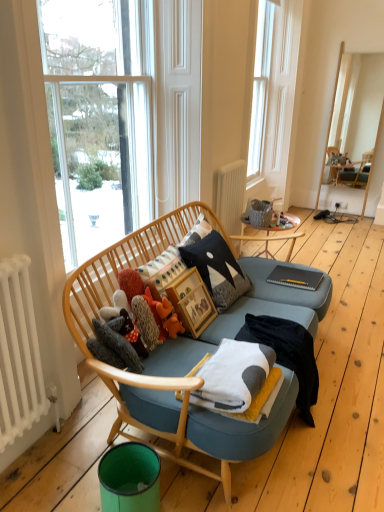
What do you see at coordinates (242, 426) in the screenshot? I see `soft yellow fabric footrest at center` at bounding box center [242, 426].

Locate an element on the screen. The width and height of the screenshot is (384, 512). fluffy orange plush at center, which appears as the 1th toy when viewed from the right is located at coordinates (169, 318).

This screenshot has width=384, height=512. What do you see at coordinates (268, 234) in the screenshot?
I see `wooden table at center` at bounding box center [268, 234].

I want to click on slate gray notebook at center, so click(295, 277).

Is white painted radiator at center, acting as the 2th radiator starting from the left, touching white radiator at lower left, marked as the 2th radiator in a top-to-bottom arrangement?

There is a gap between white painted radiator at center, acting as the 2th radiator starting from the left, and white radiator at lower left, marked as the 2th radiator in a top-to-bottom arrangement.

Is white painted radiator at center, placed as the 2th radiator when sorted from bottom to top, inside or outside of white radiator at lower left, the 1th radiator viewed from the front?

The correct answer is: outside.

From the image's perspective, between white painted radiator at center, the 2th radiator viewed from the front, and white radiator at lower left, positioned as the 2th radiator in right-to-left order, who is located below?

white radiator at lower left, positioned as the 2th radiator in right-to-left order, is shown below in the image.

Considering the sizes of objects white painted radiator at center, acting as the 2th radiator starting from the left, and white radiator at lower left, which is the first radiator in bottom-to-top order, in the image provided, who is wider, white painted radiator at center, acting as the 2th radiator starting from the left, or white radiator at lower left, which is the first radiator in bottom-to-top order,?

Wider between the two is white radiator at lower left, which is the first radiator in bottom-to-top order.

Does black cotton throw pillow at center have a lesser height compared to white radiator at lower left, arranged as the first radiator when viewed from the left?

Yes, black cotton throw pillow at center is shorter than white radiator at lower left, arranged as the first radiator when viewed from the left.

From a real-world perspective, who is located higher, black cotton throw pillow at center or white radiator at lower left, which appears as the 2th radiator when viewed from the back?

black cotton throw pillow at center.

In the image, is black cotton throw pillow at center on the left side or the right side of white radiator at lower left, arranged as the first radiator when viewed from the left?

black cotton throw pillow at center is positioned on white radiator at lower left, arranged as the first radiator when viewed from the left,'s right side.

Between white painted radiator at center, the 2th radiator viewed from the front, and fluffy orange plush at center, the second toy from the left, which one has larger size?

With larger size is white painted radiator at center, the 2th radiator viewed from the front.

From the image's perspective, is white painted radiator at center, placed as the 2th radiator when sorted from bottom to top, above or below fluffy orange plush at center, the second toy from the left?

Based on their image positions, white painted radiator at center, placed as the 2th radiator when sorted from bottom to top, is located above fluffy orange plush at center, the second toy from the left.

Between white painted radiator at center, acting as the 2th radiator starting from the left, and fluffy orange plush at center, which appears as the 1th toy when viewed from the right, which one appears on the right side from the viewer's perspective?

→ Positioned to the right is white painted radiator at center, acting as the 2th radiator starting from the left.

Is white painted radiator at center, the first radiator from the top, thinner than fluffy orange plush at center, the second toy from the left?

Correct, the width of white painted radiator at center, the first radiator from the top, is less than that of fluffy orange plush at center, the second toy from the left.

Can you tell me how much slate gray notebook at center and green matte trash can at lower left differ in facing direction?

2.25 degrees separate the facing orientations of slate gray notebook at center and green matte trash can at lower left.

From a real-world perspective, is slate gray notebook at center positioned above or below green matte trash can at lower left?

In terms of real-world spatial position, slate gray notebook at center is above green matte trash can at lower left.

Which point is more forward, (290, 268) or (140, 454)?

Point (140, 454)

From a real-world perspective, which is physically above, white radiator at lower left, arranged as the first radiator when viewed from the left, or white soft blanket at center, which is the second blanket from back to front?

white radiator at lower left, arranged as the first radiator when viewed from the left.

Consider the image. Which is more to the left, white radiator at lower left, arranged as the first radiator when viewed from the left, or white soft blanket at center, arranged as the 1th blanket when viewed from the front?

From the viewer's perspective, white radiator at lower left, arranged as the first radiator when viewed from the left, appears more on the left side.

Is white radiator at lower left, marked as the 2th radiator in a top-to-bottom arrangement, not within white soft blanket at center, which is the second blanket from back to front?

Yes, white radiator at lower left, marked as the 2th radiator in a top-to-bottom arrangement, is outside of white soft blanket at center, which is the second blanket from back to front.

In terms of size, does white radiator at lower left, marked as the 2th radiator in a top-to-bottom arrangement, appear bigger or smaller than white soft blanket at center, which is the second blanket from back to front?

Clearly, white radiator at lower left, marked as the 2th radiator in a top-to-bottom arrangement, is larger in size than white soft blanket at center, which is the second blanket from back to front.

Considering the sizes of transparent glass window at upper center and white radiator at lower left, positioned as the 2th radiator in right-to-left order, in the image, is transparent glass window at upper center taller or shorter than white radiator at lower left, positioned as the 2th radiator in right-to-left order,?

In the image, transparent glass window at upper center appears to be taller than white radiator at lower left, positioned as the 2th radiator in right-to-left order.

You are a GUI agent. You are given a task and a screenshot of the screen. Output one action in this format:
    pyautogui.click(x=<x>, y=<y>)
    Task: Click on the window above the white radiator at lower left, arranged as the first radiator when viewed from the left (from a real-world perspective)
    The width and height of the screenshot is (384, 512).
    Given the screenshot: What is the action you would take?
    pyautogui.click(x=273, y=96)

In the scene shown: Is transparent glass window at upper center closer to the viewer compared to white radiator at lower left, the 1th radiator viewed from the front?

No, it is not.

Does point (263, 136) appear closer or farther from the camera than point (23, 378)?

Point (263, 136) is positioned farther from the camera compared to point (23, 378).

Which of these two, fluffy orange plush at center, the second toy from the left, or wooden table at center, is wider?

With larger width is wooden table at center.

Are fluffy orange plush at center, the second toy from the left, and wooden table at center located far from each other?

Absolutely, fluffy orange plush at center, the second toy from the left, is distant from wooden table at center.

From the image's perspective, is fluffy orange plush at center, the second toy from the left, below wooden table at center?

Yes, from the image's perspective, fluffy orange plush at center, the second toy from the left, is beneath wooden table at center.

Where is `radiator in front of the white painted radiator at center, acting as the 2th radiator starting from the left`? This screenshot has height=512, width=384. radiator in front of the white painted radiator at center, acting as the 2th radiator starting from the left is located at coordinates (20, 355).

What are the coordinates of `radiator lying below the black cotton throw pillow at center (from the image's perspective)` in the screenshot? It's located at (20, 355).

From the picture: Considering their positions, is wooden table at center positioned closer to white radiator at lower left, positioned as the 2th radiator in right-to-left order, than black cotton throw pillow at center?

black cotton throw pillow at center lies closer to white radiator at lower left, positioned as the 2th radiator in right-to-left order, than the other object.

Estimate the real-world distances between objects in this image. Which object is closer to fuzzy fabric stuffed animal at center, which ranks as the first toy in left-to-right order, green matte trash can at lower left or white soft blanket at center, which is the second blanket from back to front?

white soft blanket at center, which is the second blanket from back to front, is closer to fuzzy fabric stuffed animal at center, which ranks as the first toy in left-to-right order.

From the image, which object appears to be nearer to slate gray notebook at center, fluffy orange plush at center, the second toy from the left, or wooden table at center?

wooden table at center.

Based on their spatial positions, is fluffy orange plush at center, which appears as the 1th toy when viewed from the right, or white soft blanket at center, which is the second blanket from back to front, further from slate gray notebook at center?

The object further to slate gray notebook at center is white soft blanket at center, which is the second blanket from back to front.

Based on their spatial positions, is transparent glass window at upper center or black cotton throw pillow at center closer to white soft blanket at center, which is the second blanket from front to back?

black cotton throw pillow at center.

From the image, which object appears to be nearer to wooden table at center, black cotton throw pillow at center or white radiator at lower left, the 1th radiator viewed from the front?

black cotton throw pillow at center is positioned closer to the anchor wooden table at center.

Estimate the real-world distances between objects in this image. Which object is closer to white soft blanket at center, arranged as the 1th blanket when viewed from the front, black cotton throw pillow at center or fuzzy fabric stuffed animal at center, the 2th toy viewed from the right?

The object closer to white soft blanket at center, arranged as the 1th blanket when viewed from the front, is fuzzy fabric stuffed animal at center, the 2th toy viewed from the right.

Considering their positions, is white painted radiator at center, acting as the 2th radiator starting from the left, positioned closer to fluffy orange plush at center, which appears as the 1th toy when viewed from the right, than black cotton throw pillow at center?

black cotton throw pillow at center.

I want to click on throw pillow between white radiator at lower left, arranged as the first radiator when viewed from the left, and slate gray notebook at center, so click(x=217, y=269).

What are the coordinates of `radiator between white soft blanket at center, which is the second blanket from back to front, and wooden table at center, along the z-axis` in the screenshot? It's located at (231, 195).

This screenshot has height=512, width=384. What are the coordinates of `throw pillow positioned between white soft blanket at center, which is the first blanket from back to front, and white painted radiator at center, placed as the 2th radiator when sorted from bottom to top, from near to far` in the screenshot? It's located at (217, 269).

At what (x,y) coordinates should I click in order to perform the action: click on pad positioned between black cotton throw pillow at center and wooden table at center from near to far. Please return your answer as a coordinate pair (x, y). Looking at the image, I should click on (295, 277).